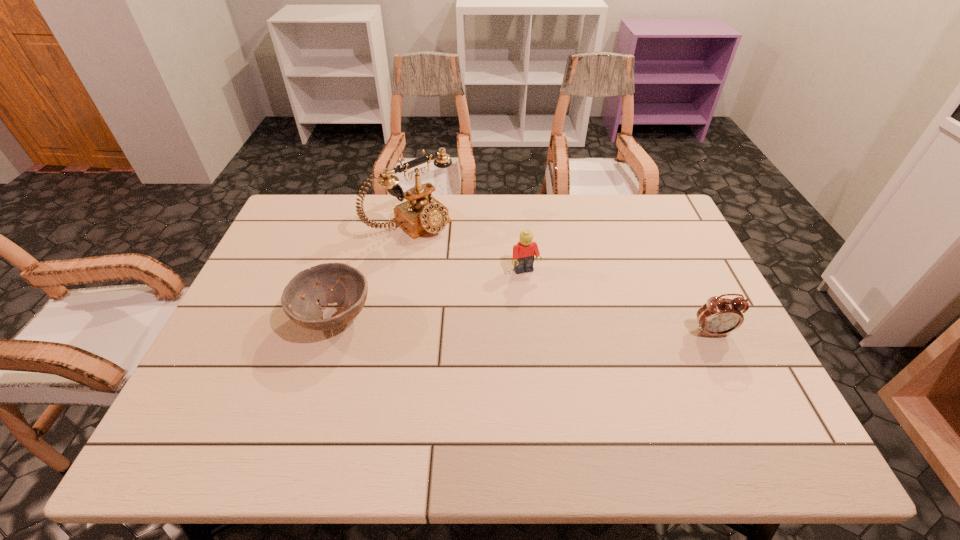
The height and width of the screenshot is (540, 960). Find the location of `vacant space on the desktop that is between the shortest object and the alarm clock and is positioned on the dial number of the farthest object`. vacant space on the desktop that is between the shortest object and the alarm clock and is positioned on the dial number of the farthest object is located at coordinates (530, 325).

The height and width of the screenshot is (540, 960). Identify the location of free spot on the desktop that is between the bowl and the rightmost object and is positioned on the face of the second farthest object. (550, 326).